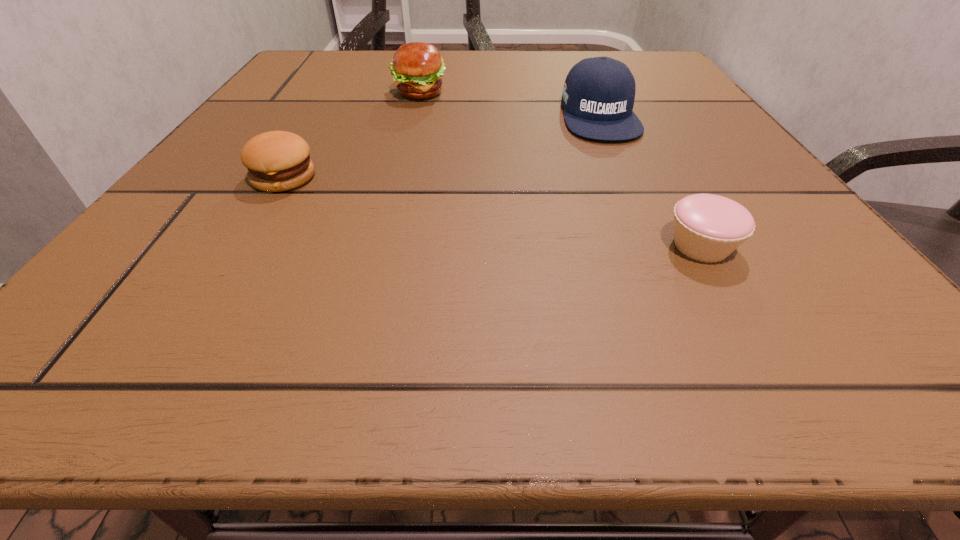
I want to click on object that is at the far edge, so click(x=417, y=67).

Find the location of a particular element. object that is at the left edge is located at coordinates (277, 161).

Locate an element on the screen. This screenshot has width=960, height=540. baseball cap at the right edge is located at coordinates (598, 96).

You are a GUI agent. You are given a task and a screenshot of the screen. Output one action in this format:
    pyautogui.click(x=<x>, y=<y>)
    Task: Click on the cupcake present at the right edge
    
    Given the screenshot: What is the action you would take?
    pyautogui.click(x=708, y=228)

This screenshot has height=540, width=960. In order to click on vacant space at the far edge of the desktop in this screenshot , I will do `click(530, 82)`.

At what (x,y) coordinates should I click in order to perform the action: click on vacant space at the near edge of the desktop. Please return your answer as a coordinate pair (x, y). Looking at the image, I should click on coord(552,346).

At what (x,y) coordinates should I click in order to perform the action: click on vacant space at the left edge of the desktop. Please return your answer as a coordinate pair (x, y). This screenshot has height=540, width=960. Looking at the image, I should click on (188, 196).

Where is `vacant space at the right edge of the desktop`? vacant space at the right edge of the desktop is located at coordinates (783, 266).

Locate an element on the screen. The image size is (960, 540). vacant space at the far left corner is located at coordinates (328, 57).

This screenshot has width=960, height=540. In order to click on vacant space at the near right corner of the desktop in this screenshot , I will do `click(878, 336)`.